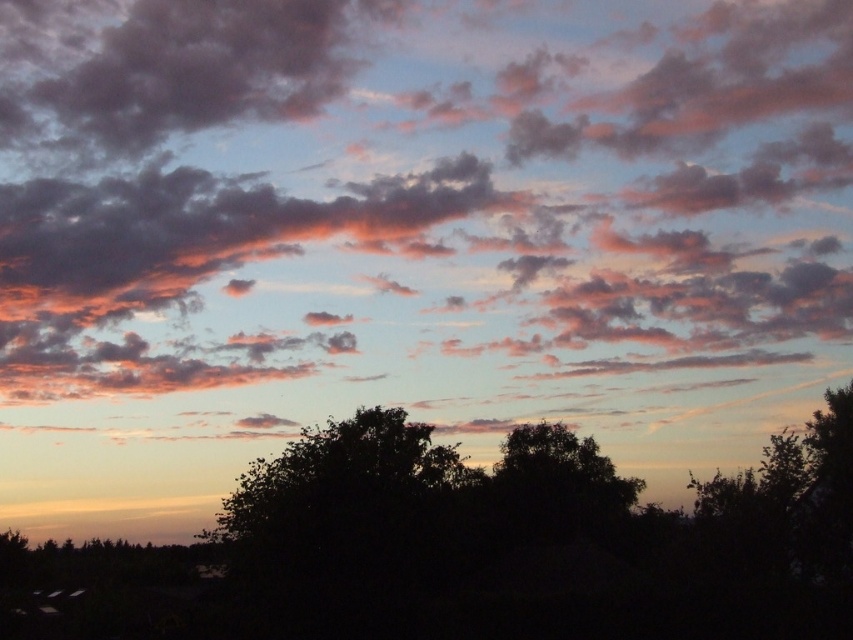
Based on the photo, how much distance is there between cloudy sky at upper center and green leafy tree at center?

cloudy sky at upper center and green leafy tree at center are 46.61 meters apart from each other.

From the picture: Who is taller, cloudy sky at upper center or green leafy tree at center?

cloudy sky at upper center

Measure the distance between cloudy sky at upper center and camera.

cloudy sky at upper center is 339.39 feet from camera.

Locate an element on the screen. Image resolution: width=853 pixels, height=640 pixels. cloudy sky at upper center is located at coordinates (416, 208).